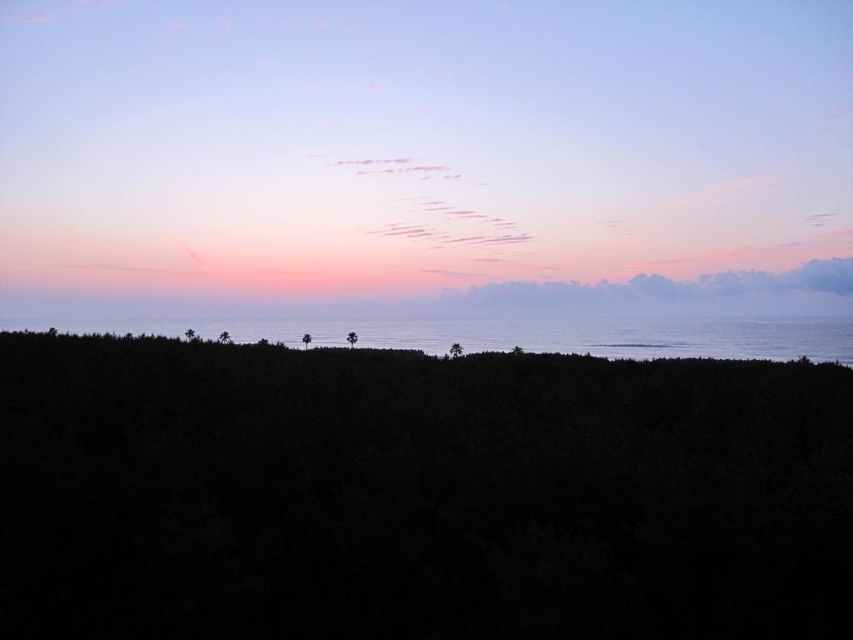
Is pastel sky at center below silvery reflective water at center?

Actually, pastel sky at center is above silvery reflective water at center.

Is pastel sky at center bigger than silvery reflective water at center?

Indeed, pastel sky at center has a larger size compared to silvery reflective water at center.

Who is more distant from viewer, (467, 140) or (782, 346)?

The point (467, 140) is behind.

I want to click on pastel sky at center, so click(422, 154).

Which is in front, point (601, 532) or point (412, 328)?

Positioned in front is point (601, 532).

Is the position of dark green foliage at center less distant than that of silvery reflective water at center?

Yes, dark green foliage at center is in front of silvery reflective water at center.

Who is more distant from viewer, (x=842, y=605) or (x=735, y=337)?

The point (x=735, y=337) is more distant.

Image resolution: width=853 pixels, height=640 pixels. I want to click on dark green foliage at center, so click(416, 493).

Is pastel sky at center further to the viewer compared to dark green foliage at center?

Yes, pastel sky at center is behind dark green foliage at center.

Which is in front, point (614, 236) or point (113, 444)?

Point (113, 444) is in front.

At what (x,y) coordinates should I click in order to perform the action: click on pastel sky at center. Please return your answer as a coordinate pair (x, y). The height and width of the screenshot is (640, 853). Looking at the image, I should click on (422, 154).